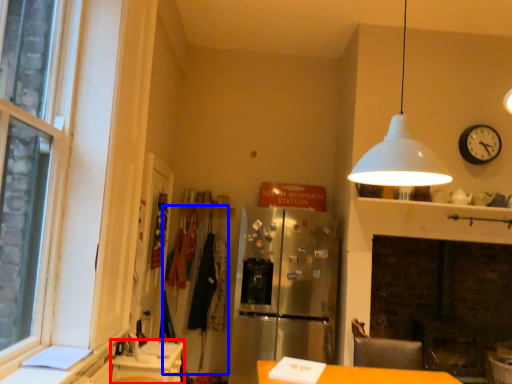
Question: Which of the following is the closest to the observer, counter (highlighted by a red box) or laundry (highlighted by a blue box)?

Choices:
 (A) counter
 (B) laundry

Answer: (A)